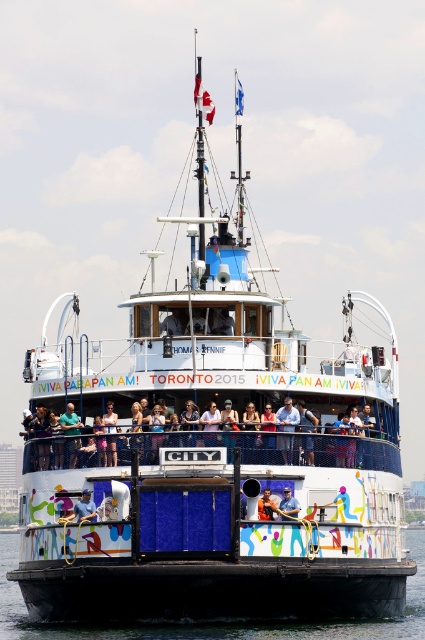
Question: Which of these objects is positioned farthest from the black rubber water at lower center?

Choices:
 (A) light blue fabric at center
 (B) blue fabric shirt at center
 (C) blue denim jeans at center

Answer: (C)

Question: Observing the image, what is the correct spatial positioning of light blue fabric at center in reference to blue denim jeans at center?

Choices:
 (A) above
 (B) below

Answer: (A)

Question: Can you confirm if light blue fabric at center is positioned to the left of blue fabric shirt at center?

Choices:
 (A) no
 (B) yes

Answer: (B)

Question: Which is nearer to the blue fabric shirt at center?

Choices:
 (A) light blue fabric at center
 (B) blue denim jeans at center
 (C) black rubber water at lower center

Answer: (B)

Question: Considering the relative positions of blue denim jeans at center and blue fabric shirt at center in the image provided, where is blue denim jeans at center located with respect to blue fabric shirt at center?

Choices:
 (A) left
 (B) right

Answer: (B)

Question: Which point is farther to the camera?

Choices:
 (A) blue denim jeans at center
 (B) light blue fabric at center

Answer: (A)